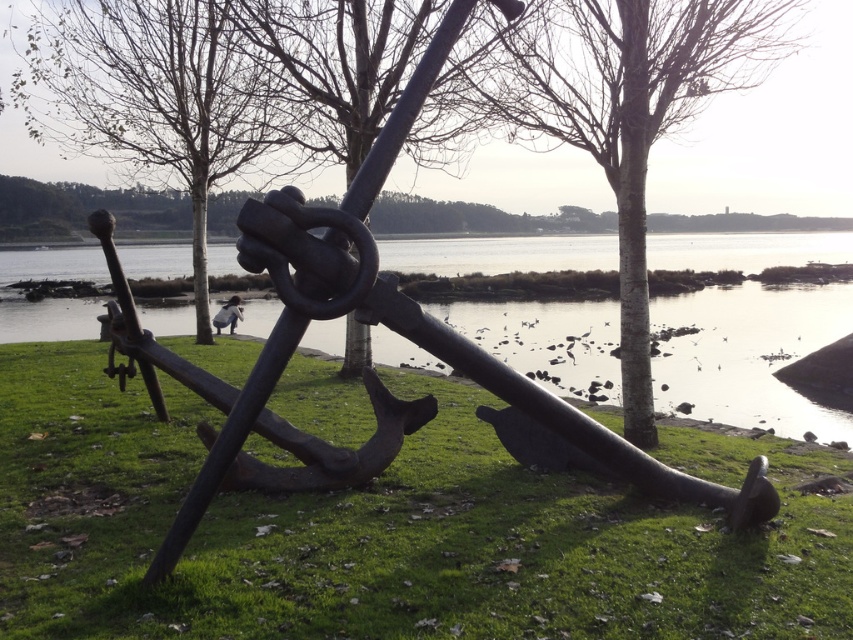
Which is behind, point (404, 477) or point (125, 42)?

The point (125, 42) is behind.

Does green grass at center have a lesser height compared to brown wood tree at center?

Yes.

Between point (256, 513) and point (170, 33), which one is positioned in front?

Point (256, 513) is in front.

This screenshot has height=640, width=853. What are the coordinates of `green grass at center` in the screenshot? It's located at (386, 531).

Which is in front, point (662, 369) or point (792, 19)?

Positioned in front is point (662, 369).

Can you confirm if glossy metallic water at center is positioned to the right of bare wood tree at center?

No, glossy metallic water at center is not to the right of bare wood tree at center.

Between point (61, 276) and point (527, 90), which one is positioned behind?

Point (61, 276)

Where is `glossy metallic water at center`? This screenshot has height=640, width=853. glossy metallic water at center is located at coordinates (749, 355).

Which of these two, bare wood tree at center or brown wood tree at center, stands taller?

Standing taller between the two is brown wood tree at center.

Is point (624, 417) positioned after point (196, 81)?

No, (624, 417) is closer to viewer.

The image size is (853, 640). What are the coordinates of `bare wood tree at center` in the screenshot? It's located at (630, 112).